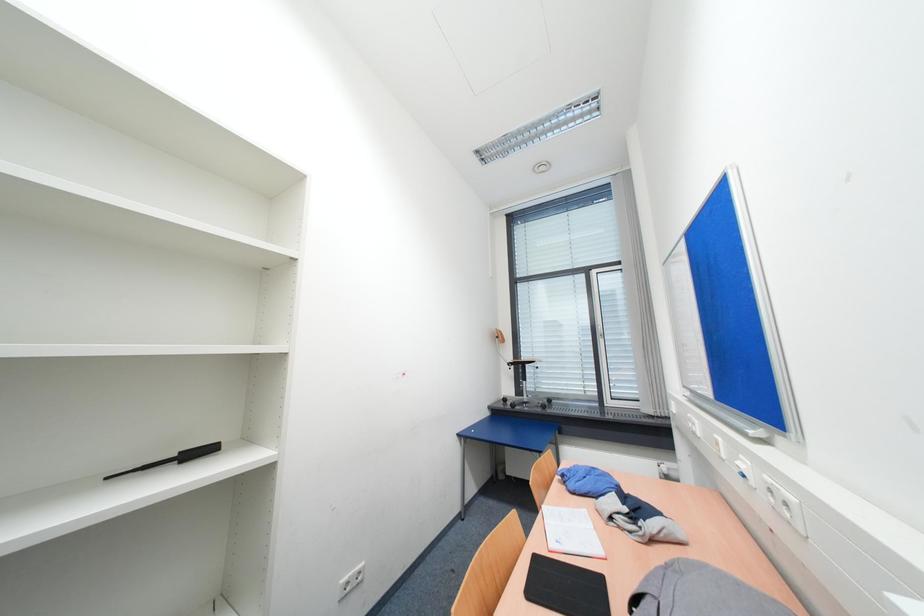
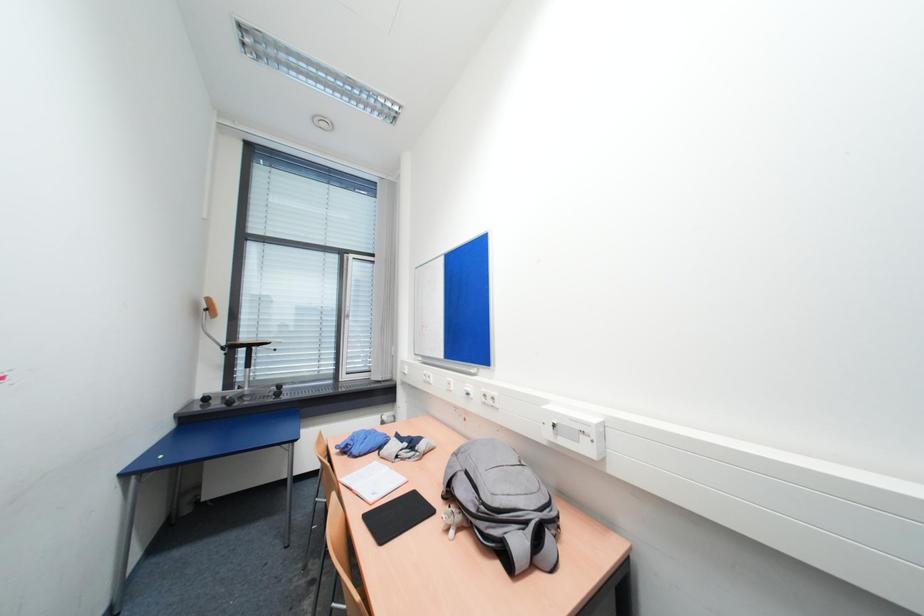
Question: The camera is either moving clockwise (left) or counter-clockwise (right) around the object. The first image is from the beginning of the video and the second image is from the end. Is the camera moving left or right when shooting the video?

Choices:
 (A) Left
 (B) Right

Answer: (A)